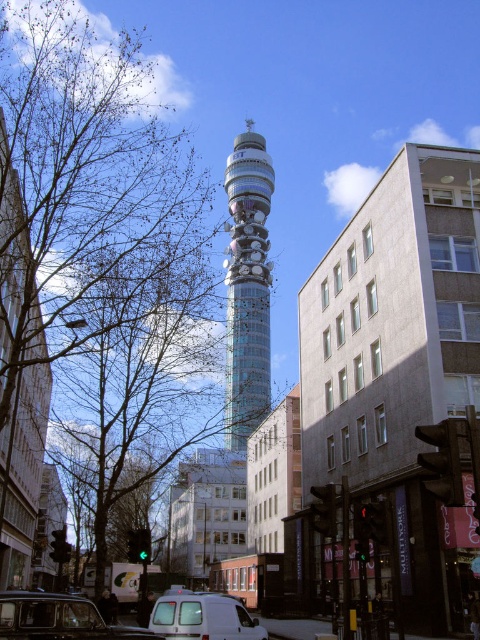
You are a city planner assessing the urban layout. Considering the translucent glass tower at center and the black matte taxi at lower left, which object occupies more space in the scene?

The translucent glass tower at center is bigger than the black matte taxi at lower left, so it occupies more space in the scene.

You are standing 200 meters away from the translucent glass tower at center. Can you safely walk towards it without any obstacles?

The distance between you and the translucent glass tower at center is 206.21 meters, so you are actually 6.21 meters farther away than you think. However, since there are no obstacles mentioned in the scene description, you can safely walk towards it.

You are a pedestrian standing at the crosswalk in front of the translucent glass tower at center. You want to cross the street to reach the white matte van at lower center. Is the van behind or in front of the tower from your perspective?

The white matte van at lower center is behind the translucent glass tower at center from your perspective, so you cannot see it directly while standing in front of the tower.